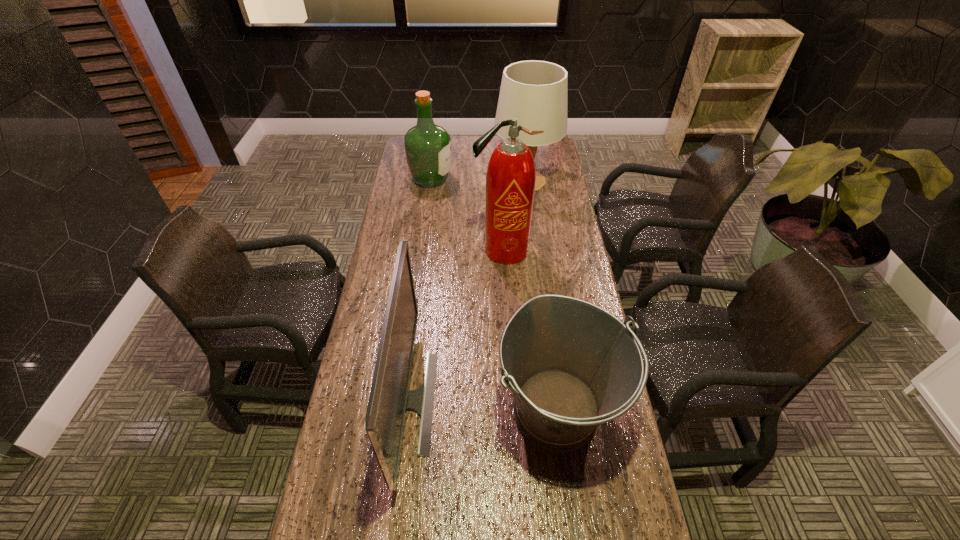
Where is `liquor at the left edge`? Image resolution: width=960 pixels, height=540 pixels. liquor at the left edge is located at coordinates (427, 146).

The height and width of the screenshot is (540, 960). I want to click on monitor situated at the left edge, so click(390, 397).

Locate an element on the screen. The image size is (960, 540). table lamp that is at the right edge is located at coordinates (534, 92).

This screenshot has width=960, height=540. Find the location of `bucket that is at the right edge`. bucket that is at the right edge is located at coordinates (570, 365).

The image size is (960, 540). What are the coordinates of `free space at the far edge of the desktop` in the screenshot? It's located at (452, 161).

The image size is (960, 540). Find the location of `vacant space at the left edge`. vacant space at the left edge is located at coordinates (389, 248).

I want to click on blank space at the right edge of the desktop, so click(534, 208).

The width and height of the screenshot is (960, 540). I want to click on free spot between the liquor and the third nearest object, so click(468, 215).

Where is `vacant region between the monitor and the shortest object`? vacant region between the monitor and the shortest object is located at coordinates (481, 406).

Identify the location of empty space between the liquor and the table lamp. This screenshot has height=540, width=960. (478, 181).